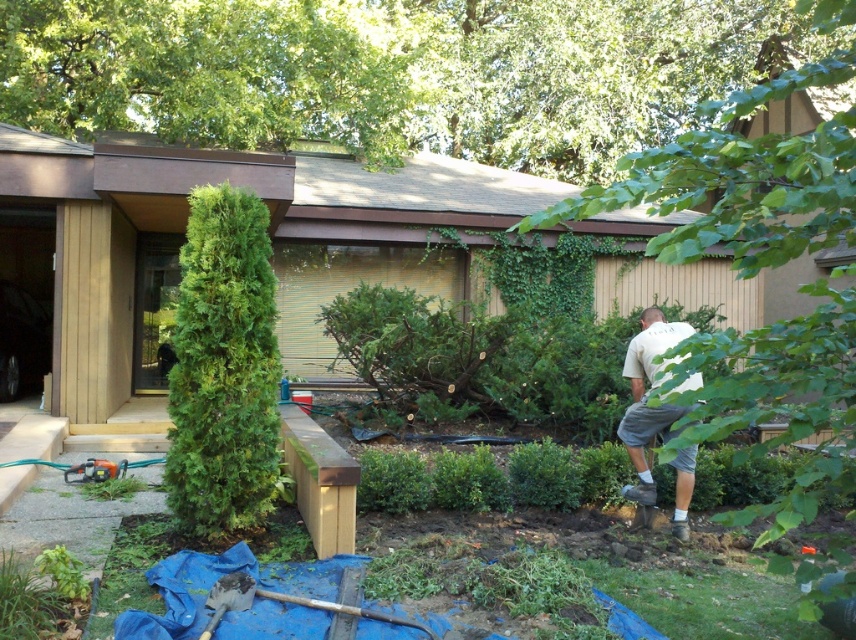
Based on the photo, you are standing in the garden and want to place a small potted plant between the two points, point (x=779, y=524) and point (x=623, y=369). Which point should the potted plant be closer to if you want it to be nearer to the camera?

The potted plant should be placed closer to point (x=779, y=524) because it is closer to the camera than point (x=623, y=369).

You are standing in the residential outdoor scene. You want to take a photo of the white cotton shirt at lower right without the green leafy tree at center blocking the view. Is this possible?

The green leafy tree at center is in front of the white cotton shirt at lower right, so you cannot take a photo of the white cotton shirt at lower right without the tree blocking the view.

You are standing at the center of the garden and want to plant a new flower bed. The green leafy tree at center is in your way. Can you move around it to access the area behind it?

The green leafy tree at center is located at point (736, 193), so yes, you can move around it to access the area behind the tree since it is positioned at a specific coordinate allowing passage around it.